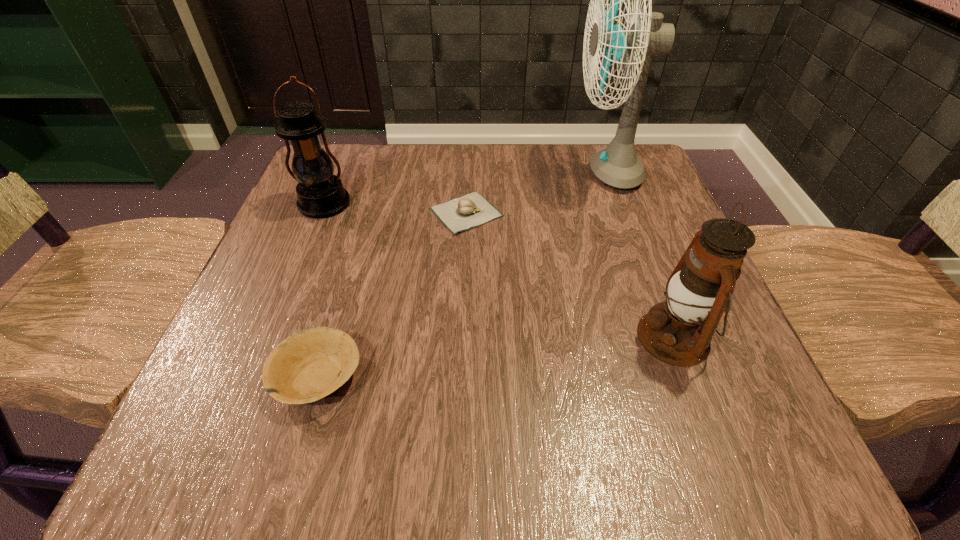
Where is `free location located on the side of the nearer lantern, there is a wick adjustment knob`? This screenshot has height=540, width=960. free location located on the side of the nearer lantern, there is a wick adjustment knob is located at coordinates (560, 337).

Image resolution: width=960 pixels, height=540 pixels. In order to click on free space located 0.060m on the side of the nearer lantern, there is a wick adjustment knob in this screenshot , I will do (x=599, y=337).

Identify the location of free space located on the side of the nearer lantern, there is a wick adjustment knob. (586, 337).

Find the location of a particular element. vacant region located 0.060m on the left of the second shortest object is located at coordinates (230, 377).

At what (x,y) coordinates should I click in order to perform the action: click on vacant area located 0.060m on the back of the third object from right to left. Please return your answer as a coordinate pair (x, y). Looking at the image, I should click on (468, 175).

Where is `fan that is at the far edge`? fan that is at the far edge is located at coordinates (617, 165).

Locate an element on the screen. lantern present at the far edge is located at coordinates (321, 194).

Find the location of `garlic located at the far edge`. garlic located at the far edge is located at coordinates (460, 214).

The image size is (960, 540). Find the location of `object positioned at the near edge`. object positioned at the near edge is located at coordinates click(x=309, y=365).

At what (x,y) coordinates should I click in order to perform the action: click on lantern that is at the left edge. Please return your answer as a coordinate pair (x, y). Looking at the image, I should click on (321, 194).